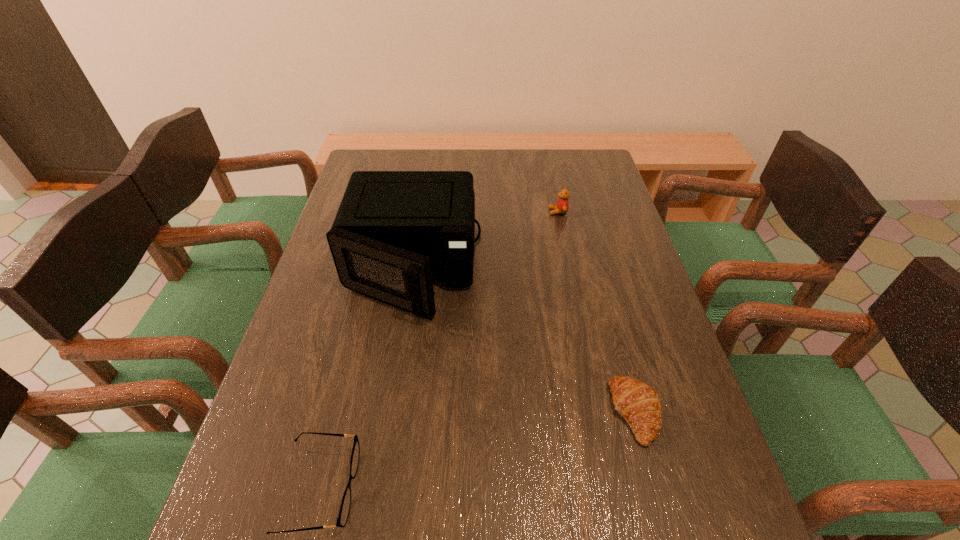
Locate an element on the screen. This screenshot has height=540, width=960. free space in the image that satisfies the following two spatial constraints: 1. with the door open on the tallest object; 2. on the left side of the crescent roll is located at coordinates [x=377, y=412].

In order to click on vacant area in the image that satisfies the following two spatial constraints: 1. on the front-facing side of the third shortest object; 2. with the door open on the tallest object in this screenshot , I will do `click(569, 267)`.